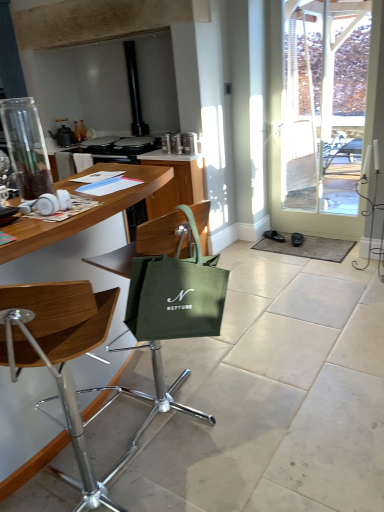
Question: Is green fabric bag at center, acting as the 1th chair starting from the back, shorter than transparent glass door at right?

Choices:
 (A) yes
 (B) no

Answer: (A)

Question: Would you say green fabric bag at center, acting as the 1th chair starting from the back, contains transparent glass door at right?

Choices:
 (A) no
 (B) yes

Answer: (A)

Question: Can you confirm if green fabric bag at center, which appears as the 2th chair when viewed from the front, is smaller than transparent glass door at right?

Choices:
 (A) no
 (B) yes

Answer: (A)

Question: Does green fabric bag at center, which appears as the 2th chair when viewed from the front, have a greater height compared to transparent glass door at right?

Choices:
 (A) no
 (B) yes

Answer: (A)

Question: Considering the relative sizes of green fabric bag at center, acting as the 1th chair starting from the back, and transparent glass door at right in the image provided, is green fabric bag at center, acting as the 1th chair starting from the back, wider than transparent glass door at right?

Choices:
 (A) no
 (B) yes

Answer: (B)

Question: Does green fabric bag at center, which appears as the 2th chair when viewed from the front, appear on the right side of transparent glass door at right?

Choices:
 (A) yes
 (B) no

Answer: (B)

Question: Would you say woodenmaterial/texturetable at left contains clear glass jar at left?

Choices:
 (A) yes
 (B) no

Answer: (B)

Question: Is woodenmaterial/texturetable at left taller than clear glass jar at left?

Choices:
 (A) yes
 (B) no

Answer: (A)

Question: Is woodenmaterial/texturetable at left completely or partially outside of clear glass jar at left?

Choices:
 (A) no
 (B) yes

Answer: (B)

Question: From the image's perspective, is woodenmaterial/texturetable at left on top of clear glass jar at left?

Choices:
 (A) no
 (B) yes

Answer: (A)

Question: Could you tell me if woodenmaterial/texturetable at left is facing clear glass jar at left?

Choices:
 (A) yes
 (B) no

Answer: (B)

Question: From the image's perspective, is woodenmaterial/texturetable at left below clear glass jar at left?

Choices:
 (A) no
 (B) yes

Answer: (B)

Question: From the image's perspective, does clear glass jar at left appear higher than green fabric cabinet at center?

Choices:
 (A) yes
 (B) no

Answer: (B)